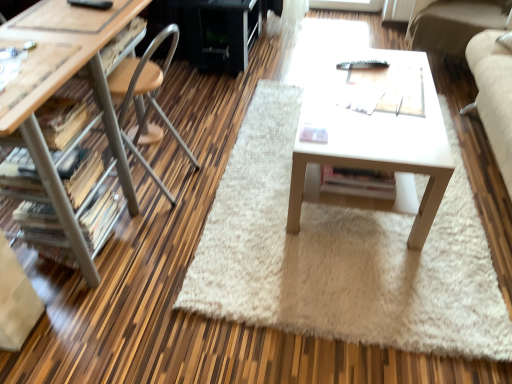
At what (x,y) coordinates should I click in order to perform the action: click on empty space that is in between matte wood desk at left and white shaggy rug at center. Please return your answer as a coordinate pair (x, y). Looking at the image, I should click on tap(176, 221).